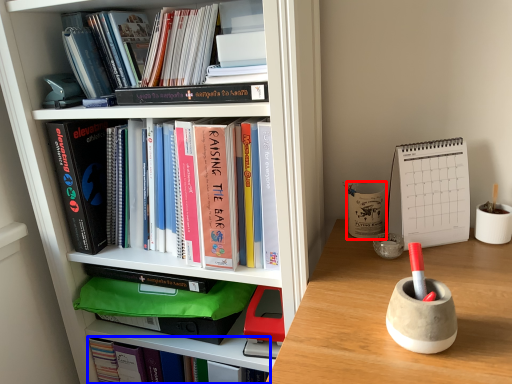
Question: Which object appears farthest to the camera in this image, stationery (highlighted by a red box) or book (highlighted by a blue box)?

Choices:
 (A) stationery
 (B) book

Answer: (B)